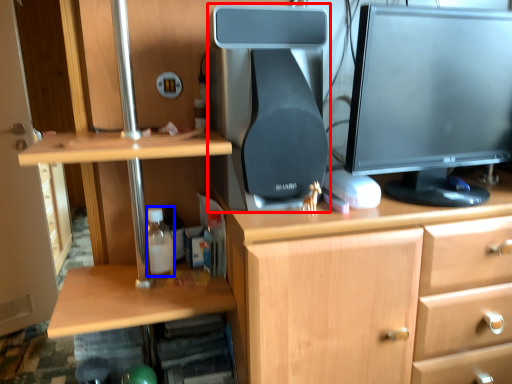
Question: Which point is further to the camera, desktop computer (highlighted by a red box) or bottle (highlighted by a blue box)?

Choices:
 (A) desktop computer
 (B) bottle

Answer: (B)